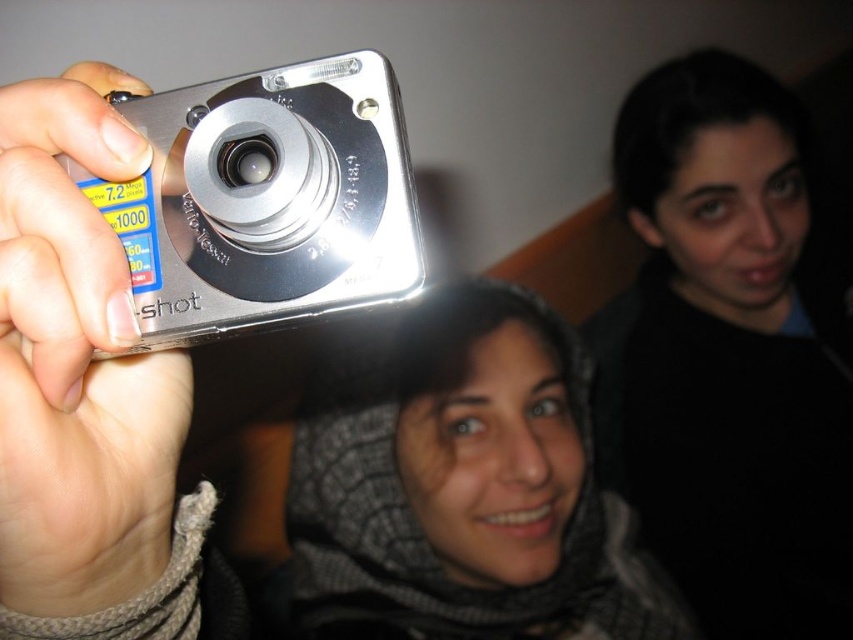
Question: Considering the relative positions of silver metallic camera at upper left and silver metallic camera at left in the image provided, where is silver metallic camera at upper left located with respect to silver metallic camera at left?

Choices:
 (A) right
 (B) left

Answer: (B)

Question: Does black matte scarf at upper center appear on the left side of gray knitted scarf at center?

Choices:
 (A) yes
 (B) no

Answer: (B)

Question: Which of the following is the farthest from the observer?

Choices:
 (A) (15, 580)
 (B) (329, 90)

Answer: (B)

Question: Which point is farther to the camera?

Choices:
 (A) coord(80,417)
 (B) coord(454,582)

Answer: (B)

Question: Among these points, which one is nearest to the camera?

Choices:
 (A) (13, 547)
 (B) (421, 588)

Answer: (A)

Question: Does silver metallic camera at upper left appear on the left side of silver metallic camera at left?

Choices:
 (A) no
 (B) yes

Answer: (B)